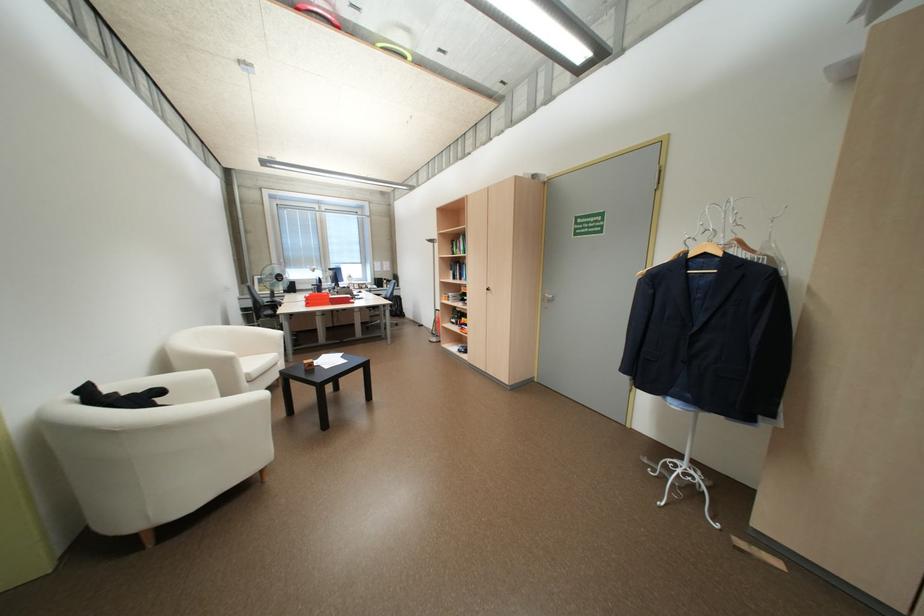
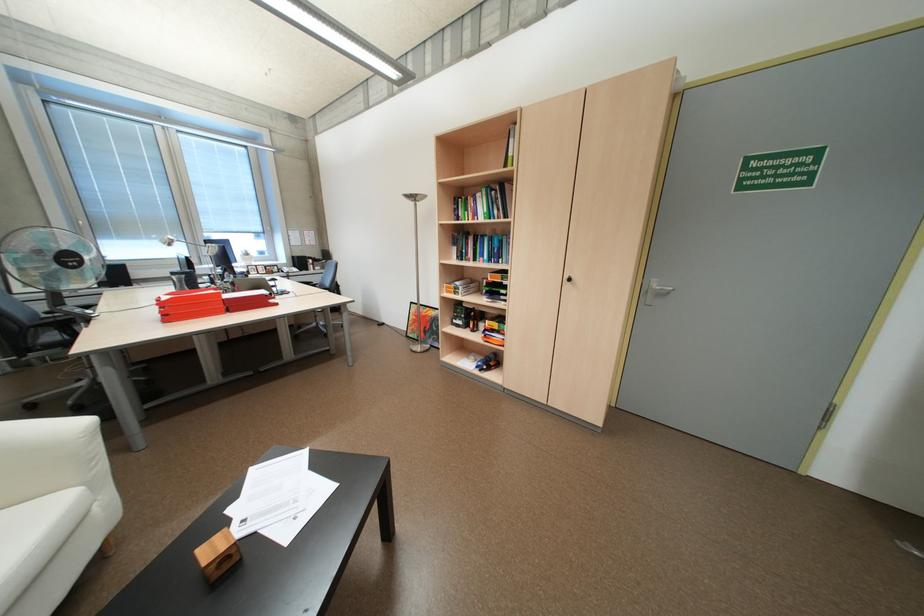
The point at (317, 298) is marked in the first image. Where is the corresponding point in the second image?

(173, 304)